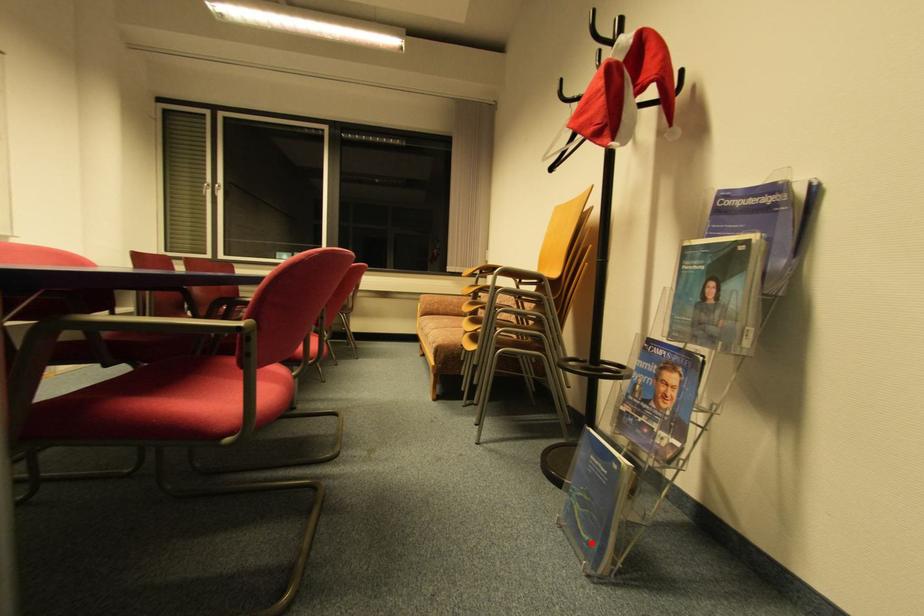
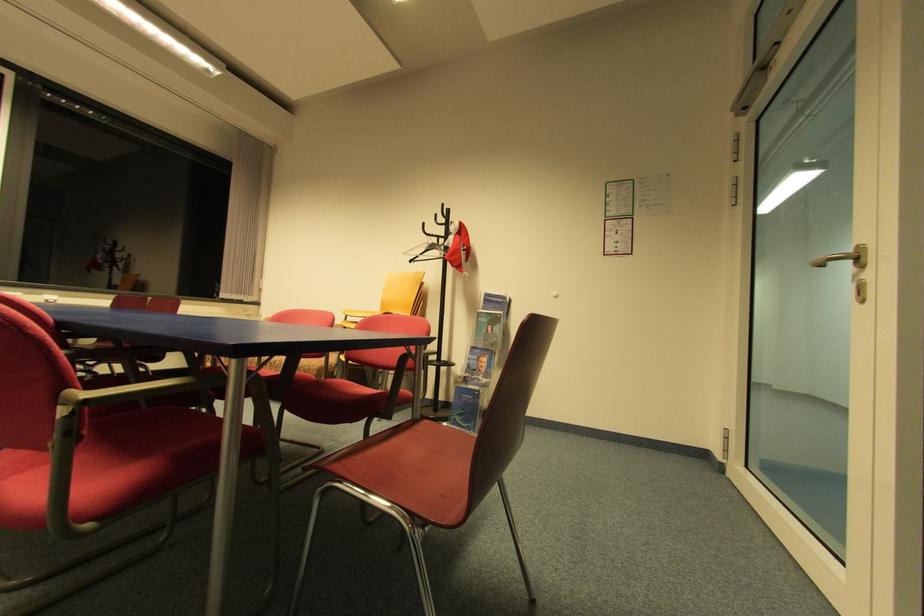
Where in the second image is the point corresponding to the highlighted location from the first image?

(472, 427)